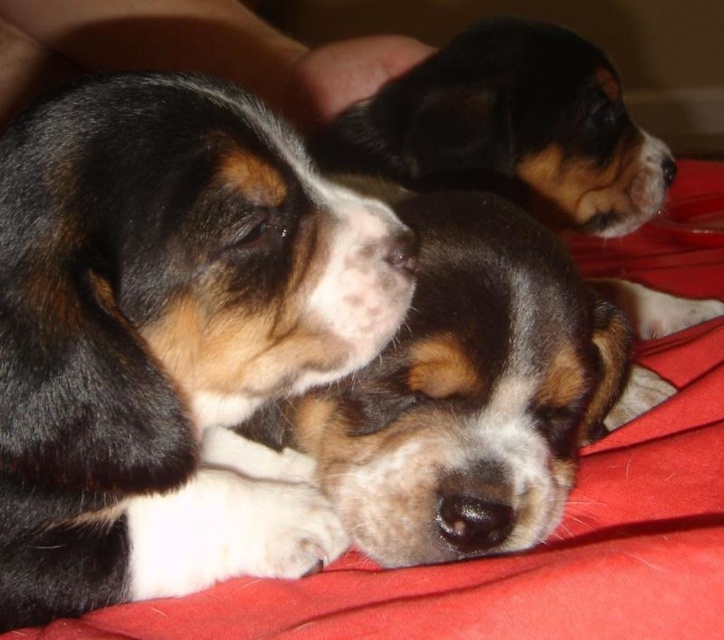
Question: Does tri-color fur puppy at center have a smaller size compared to tri-color fur beagle at center?

Choices:
 (A) no
 (B) yes

Answer: (B)

Question: Is the position of tri-color fur beagle at center more distant than that of smooth skin hand at upper left?

Choices:
 (A) no
 (B) yes

Answer: (A)

Question: Estimate the real-world distances between objects in this image. Which object is closer to the tri-color fur beagle at center?

Choices:
 (A) tri-color fur puppy at center
 (B) smooth skin hand at upper left

Answer: (A)

Question: Among these objects, which one is farthest from the camera?

Choices:
 (A) smooth skin hand at upper left
 (B) tri-color fur beagle at center

Answer: (A)

Question: Does tri-color fur puppy at center have a greater width compared to tri-color fur beagle at center?

Choices:
 (A) no
 (B) yes

Answer: (A)

Question: Which point is farther to the camera?

Choices:
 (A) tri-color fur puppy at center
 (B) tri-color fur beagle at center
 (C) smooth skin hand at upper left

Answer: (C)